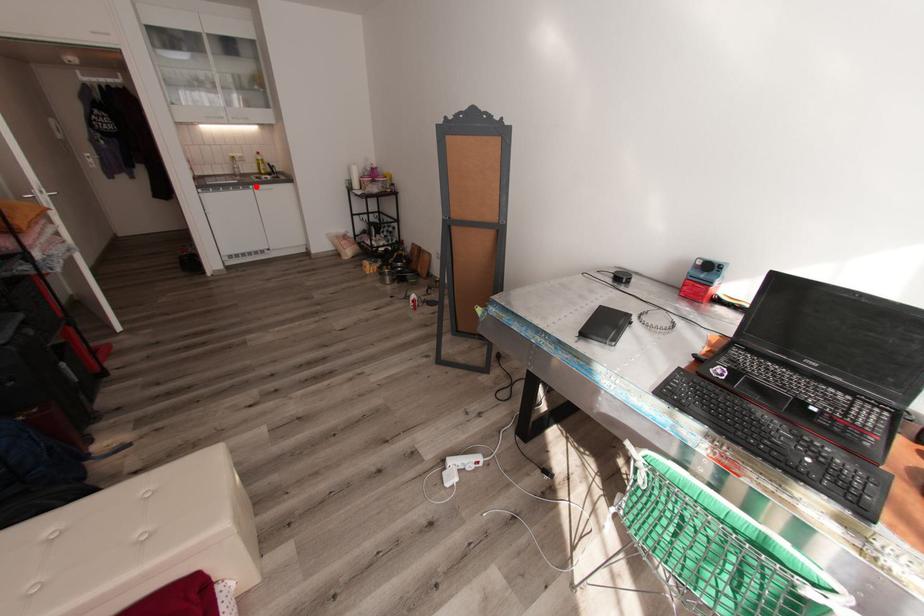
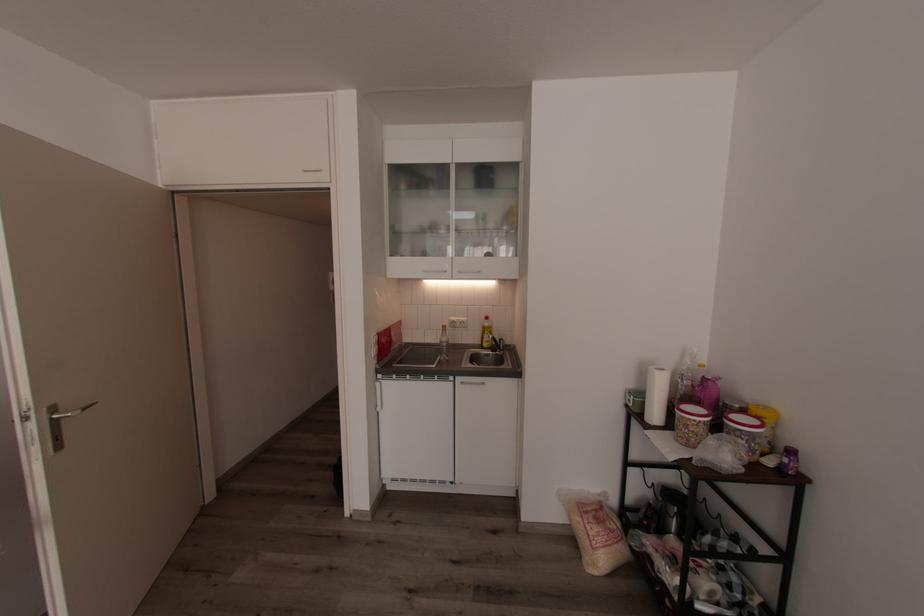
Question: I am providing you with two images of the same scene from different viewpoints. A red point is shown in image1. For the corresponding object point in image2, is it positioned nearer or farther from the camera?

Choices:
 (A) Nearer
 (B) Farther

Answer: (B)